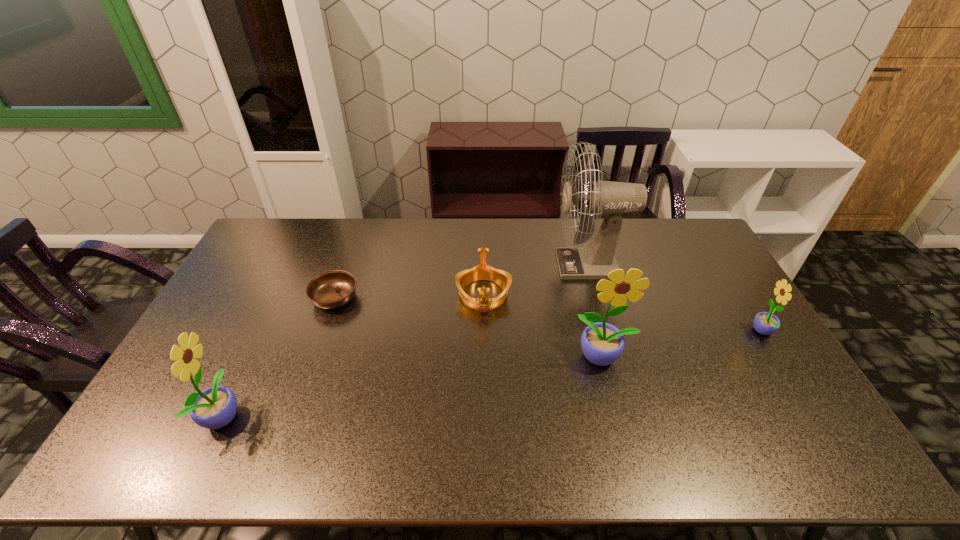
Identify the location of the nearest sunflower. (215, 407).

This screenshot has height=540, width=960. I want to click on the leftmost object, so click(215, 407).

Where is `the second sunflower from right to left`? Image resolution: width=960 pixels, height=540 pixels. the second sunflower from right to left is located at coordinates (602, 343).

In order to click on the rightmost object in this screenshot , I will do `click(765, 323)`.

Where is `the rightmost sunflower`? Image resolution: width=960 pixels, height=540 pixels. the rightmost sunflower is located at coordinates (765, 323).

Find the location of a particular element. Image resolution: width=960 pixels, height=540 pixels. the tallest object is located at coordinates (612, 199).

I want to click on the fifth object from right to left, so click(332, 289).

I want to click on the shortest object, so click(332, 289).

You are a GUI agent. You are given a task and a screenshot of the screen. Output one action in this format:
    pyautogui.click(x=<x>, y=<y>)
    Task: Click on the tiara
    The image size is (960, 540).
    Given the screenshot: What is the action you would take?
    pyautogui.click(x=483, y=271)

Find the location of a particular element. The height and width of the screenshot is (540, 960). the fifth tallest object is located at coordinates (483, 271).